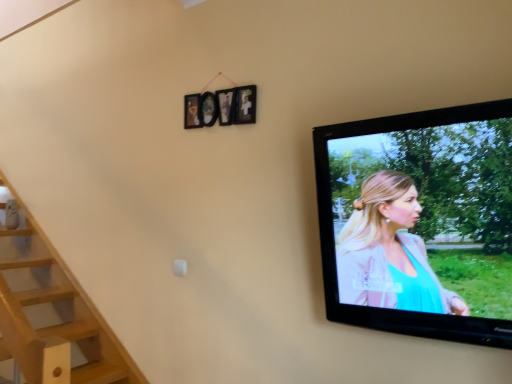
Question: Considering the positions of point (328, 172) and point (216, 110), is point (328, 172) closer or farther from the camera than point (216, 110)?

Choices:
 (A) farther
 (B) closer

Answer: (B)

Question: From the image's perspective, is black glossy television at upper right above or below wooden picture frame at upper center?

Choices:
 (A) above
 (B) below

Answer: (B)

Question: From a real-world perspective, is black glossy television at upper right physically located above or below wooden picture frame at upper center?

Choices:
 (A) below
 (B) above

Answer: (A)

Question: Considering their positions, is wooden picture frame at upper center located in front of or behind black glossy television at upper right?

Choices:
 (A) behind
 (B) front

Answer: (A)

Question: From the image's perspective, is wooden picture frame at upper center located above or below black glossy television at upper right?

Choices:
 (A) below
 (B) above

Answer: (B)

Question: Is wooden picture frame at upper center inside the boundaries of black glossy television at upper right, or outside?

Choices:
 (A) inside
 (B) outside

Answer: (B)

Question: Visually, is wooden picture frame at upper center positioned to the left or to the right of black glossy television at upper right?

Choices:
 (A) right
 (B) left

Answer: (B)